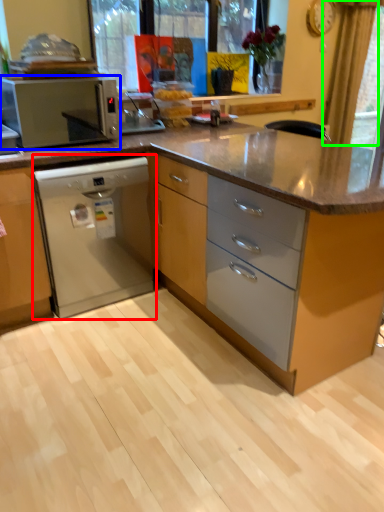
Question: Which is nearer to the home appliance (highlighted by a red box)? kitchen appliance (highlighted by a blue box) or curtain (highlighted by a green box).

Choices:
 (A) kitchen appliance
 (B) curtain

Answer: (A)